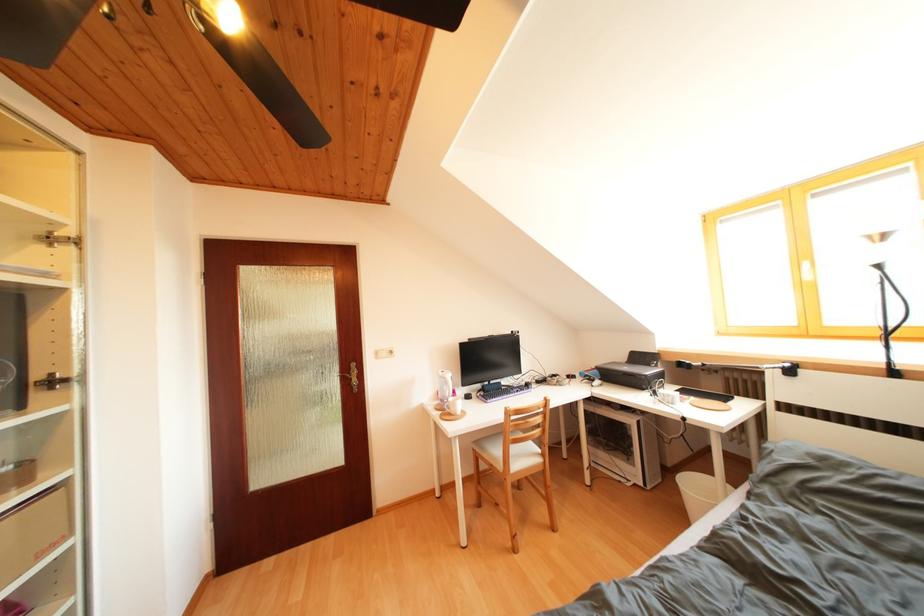
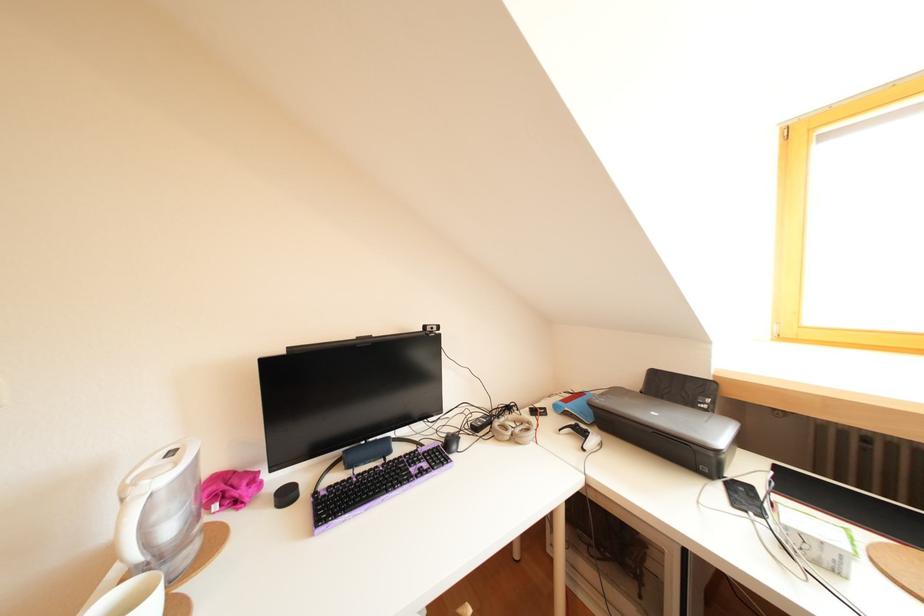
Locate, in the second image, the point that corresponds to point (562, 381) in the first image.

(516, 413)